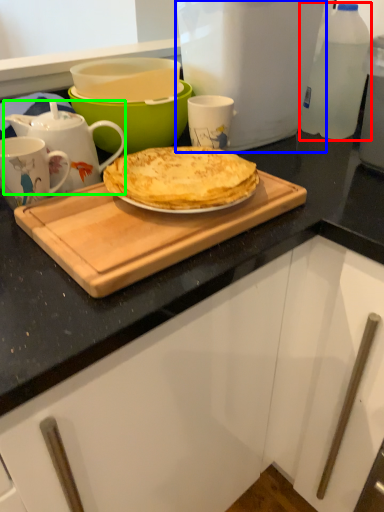
Question: Estimate the real-world distances between objects in this image. Which object is farther from bottle (highlighted by a red box), kitchen appliance (highlighted by a blue box) or teapot (highlighted by a green box)?

Choices:
 (A) kitchen appliance
 (B) teapot

Answer: (B)